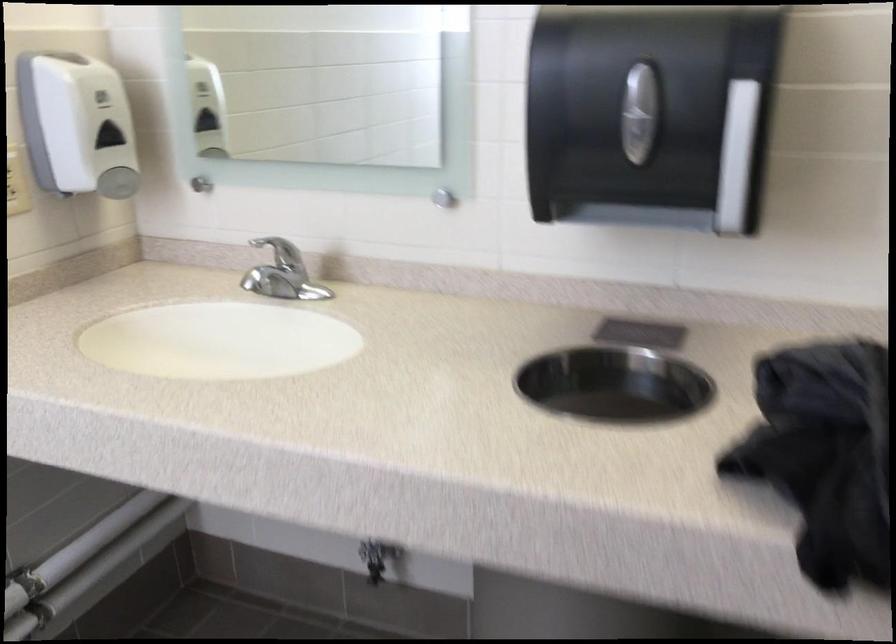
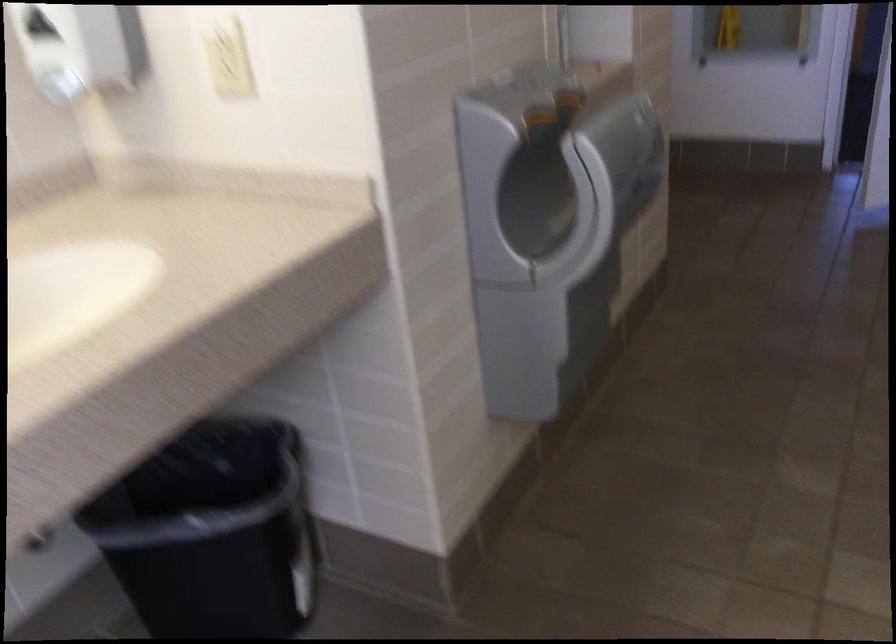
Based on the continuous images, in which direction is the camera rotating?

The camera rotated toward right-down.